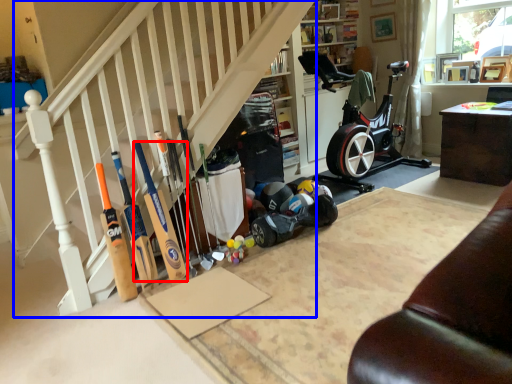
Question: Which object is further to the camera taking this photo, baseball bat (highlighted by a red box) or stairwell (highlighted by a blue box)?

Choices:
 (A) baseball bat
 (B) stairwell

Answer: (A)